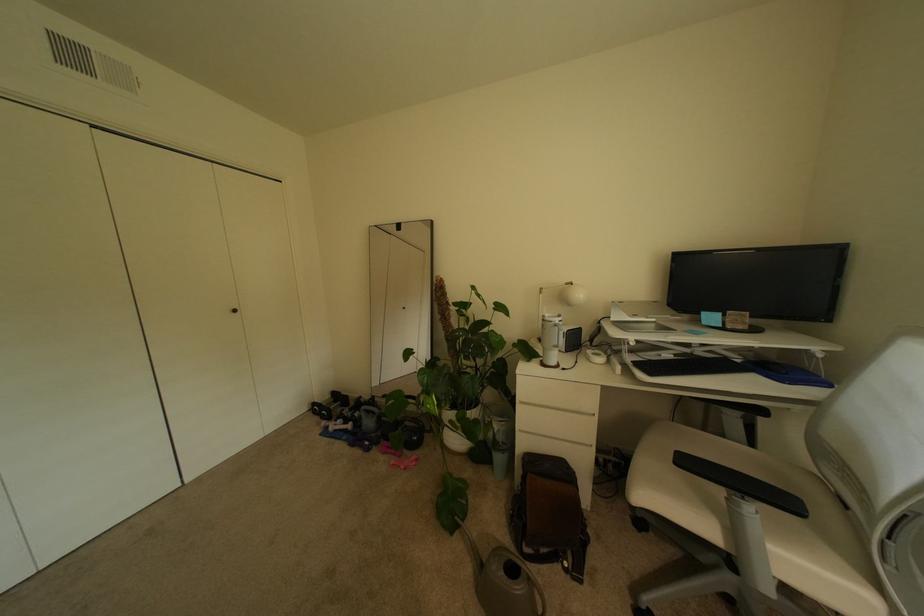
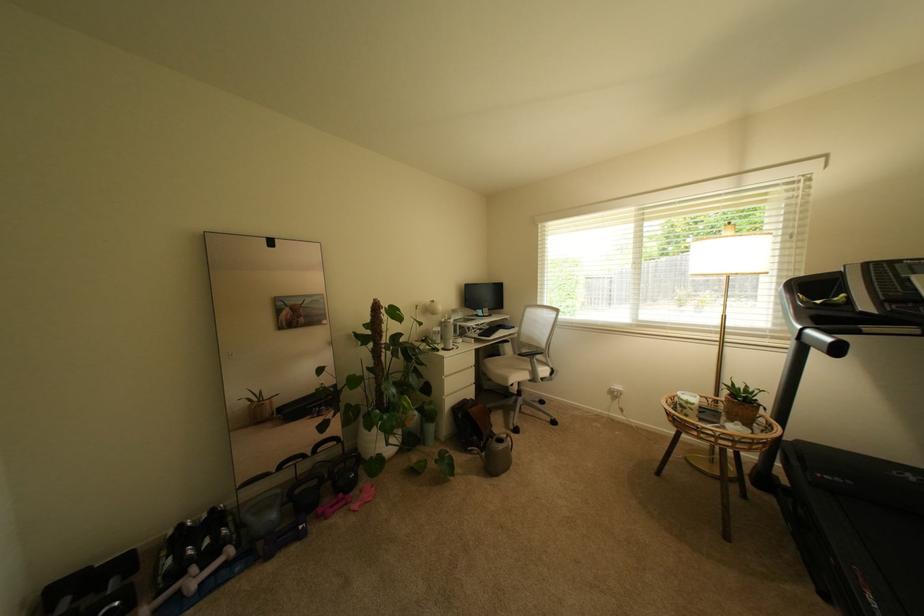
In the second image, find the point that corresponds to [334,414] in the first image.

(126, 604)